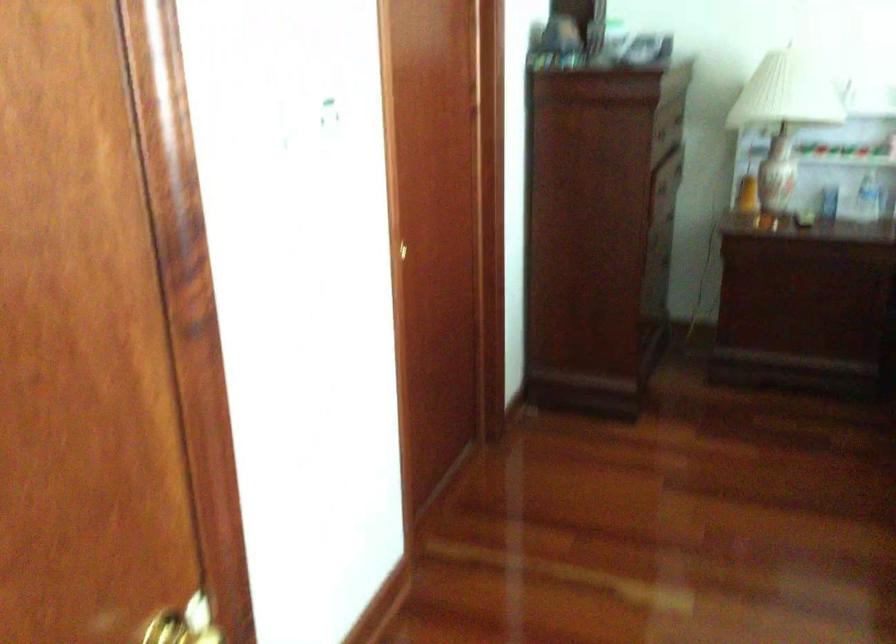
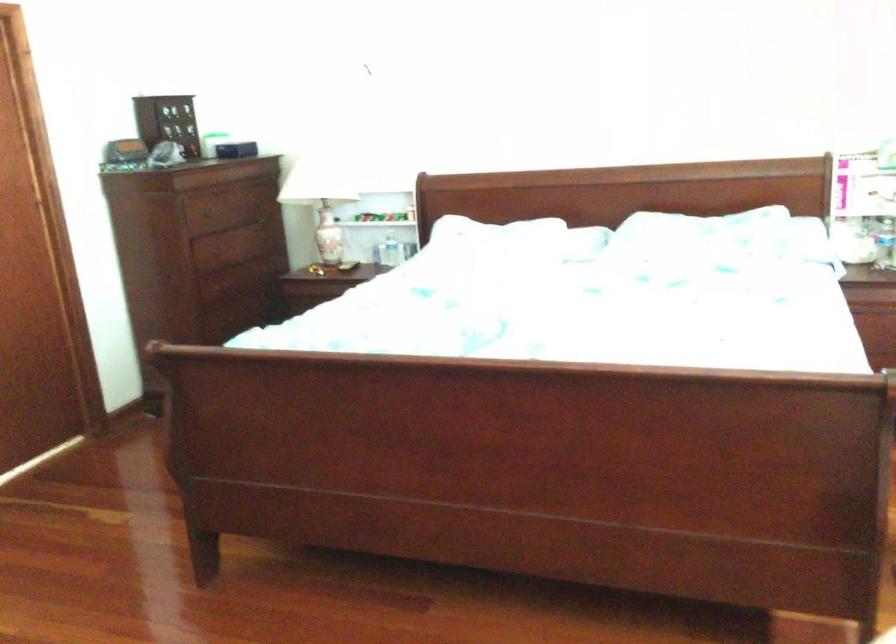
Find the pixel in the second image that matches (x=633, y=161) in the first image.

(209, 252)